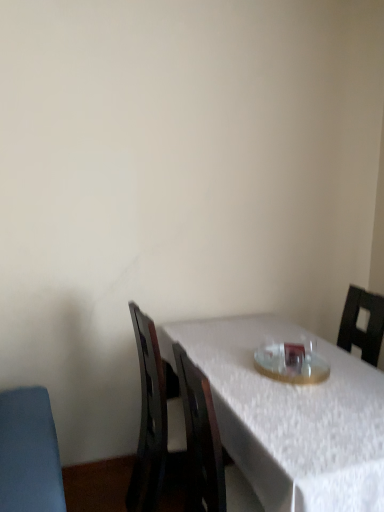
This screenshot has width=384, height=512. Describe the element at coordinates (291, 416) in the screenshot. I see `white textured table at center` at that location.

The width and height of the screenshot is (384, 512). Find the location of `white textured table at center`. white textured table at center is located at coordinates (291, 416).

What do you see at coordinates (291, 362) in the screenshot? This screenshot has height=512, width=384. I see `clear glass plate at center` at bounding box center [291, 362].

This screenshot has width=384, height=512. Find the location of `clear glass plate at center`. clear glass plate at center is located at coordinates (291, 362).

Identify the location of white textured table at center. (291, 416).

Can you confirm if white textured table at center is positioned to the left of clear glass plate at center?

Yes.

Which is behind, white textured table at center or clear glass plate at center?

clear glass plate at center is further away from the camera.

Considering the points (271, 510) and (303, 353), which point is in front, point (271, 510) or point (303, 353)?

The point (271, 510) is closer.

From the image's perspective, is white textured table at center located above or below clear glass plate at center?

white textured table at center is situated lower than clear glass plate at center in the image.

From a real-world perspective, is white textured table at center positioned above or below clear glass plate at center?

white textured table at center is situated lower than clear glass plate at center in the real world.

Is white textured table at center thinner than clear glass plate at center?

No, white textured table at center is not thinner than clear glass plate at center.

Consider the image. Between white textured table at center and clear glass plate at center, which one has less height?

Standing shorter between the two is clear glass plate at center.

Considering the sizes of objects white textured table at center and clear glass plate at center in the image provided, who is smaller, white textured table at center or clear glass plate at center?

clear glass plate at center.

Is white textured table at center located outside clear glass plate at center?

Indeed, white textured table at center is completely outside clear glass plate at center.

Is white textured table at center touching clear glass plate at center?

white textured table at center and clear glass plate at center are not in contact.

Is white textured table at center turned away from clear glass plate at center?

No.

Can you tell me how much white textured table at center and clear glass plate at center differ in facing direction?

The angle between the facing direction of white textured table at center and the facing direction of clear glass plate at center is 1.07 degrees.

Locate an element on the screen. tableware that is behind the white textured table at center is located at coordinates (291, 362).

Between clear glass plate at center and white textured table at center, which one appears on the right side from the viewer's perspective?

Positioned to the right is clear glass plate at center.

In the image, is clear glass plate at center positioned in front of or behind white textured table at center?

Clearly, clear glass plate at center is behind white textured table at center.

Considering the positions of point (261, 354) and point (322, 483), is point (261, 354) closer or farther from the camera than point (322, 483)?

Point (261, 354) is positioned farther from the camera compared to point (322, 483).

From the image's perspective, would you say clear glass plate at center is shown under white textured table at center?

No, from the image's perspective, clear glass plate at center is not beneath white textured table at center.

From a real-world perspective, is clear glass plate at center positioned under white textured table at center based on gravity?

Incorrect, from a real-world perspective, clear glass plate at center is higher than white textured table at center.

Between clear glass plate at center and white textured table at center, which one has smaller width?

clear glass plate at center.

Between clear glass plate at center and white textured table at center, which one has less height?

Standing shorter between the two is clear glass plate at center.

Who is smaller, clear glass plate at center or white textured table at center?

clear glass plate at center is smaller.

Would you say clear glass plate at center is inside or outside white textured table at center?

clear glass plate at center is spatially positioned inside white textured table at center.

Are clear glass plate at center and white textured table at center making contact?

No, clear glass plate at center is not in contact with white textured table at center.

Is clear glass plate at center aimed at white textured table at center?

No.

How many degrees apart are the facing directions of clear glass plate at center and white textured table at center?

They differ by 1.07 degrees in their facing directions.

This screenshot has width=384, height=512. Identify the location of table below the clear glass plate at center (from the image's perspective). (291, 416).

Find the location of a particular element. This screenshot has height=512, width=384. tableware that is behind the white textured table at center is located at coordinates (291, 362).

Image resolution: width=384 pixels, height=512 pixels. I want to click on tableware above the white textured table at center (from the image's perspective), so click(291, 362).